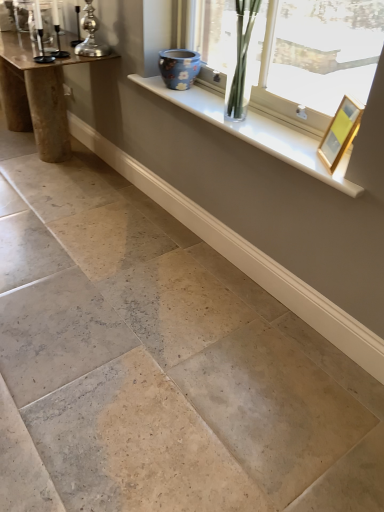
Locate an element on the screen. unoccupied space behind metallic silver candle holder at left, the 1th candle holder in the left-to-right sequence is located at coordinates (44, 55).